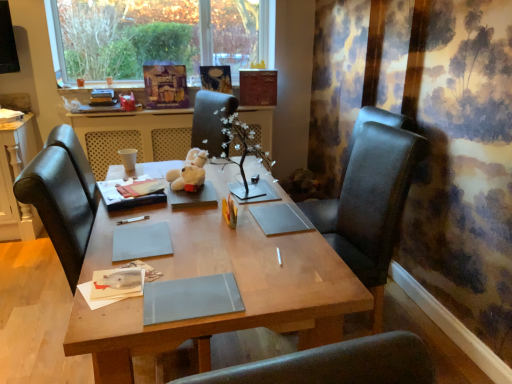
Question: From a real-world perspective, does white plush bear at center stand above black leather chair at right?

Choices:
 (A) no
 (B) yes

Answer: (B)

Question: Does white plush bear at center turn towards black leather chair at right?

Choices:
 (A) yes
 (B) no

Answer: (B)

Question: Is white plush bear at center smaller than black leather chair at right?

Choices:
 (A) yes
 (B) no

Answer: (A)

Question: From the image's perspective, is white plush bear at center on top of black leather chair at right?

Choices:
 (A) yes
 (B) no

Answer: (A)

Question: Considering the relative positions of white plush bear at center and black leather chair at right in the image provided, is white plush bear at center to the left of black leather chair at right from the viewer's perspective?

Choices:
 (A) no
 (B) yes

Answer: (B)

Question: From a real-world perspective, is white plush bear at center under black leather chair at right?

Choices:
 (A) no
 (B) yes

Answer: (A)

Question: Does wooden table at center turn towards matte gray notebook at center, placed as the first notebook when sorted from front to back?

Choices:
 (A) no
 (B) yes

Answer: (B)

Question: From the image's perspective, is wooden table at center under matte gray notebook at center, positioned as the second notebook in left-to-right order?

Choices:
 (A) yes
 (B) no

Answer: (B)

Question: Is wooden table at center in contact with matte gray notebook at center, positioned as the second notebook in left-to-right order?

Choices:
 (A) no
 (B) yes

Answer: (A)

Question: Considering the relative positions of wooden table at center and matte gray notebook at center, which is counted as the 2th notebook, starting from the top, in the image provided, is wooden table at center behind matte gray notebook at center, which is counted as the 2th notebook, starting from the top,?

Choices:
 (A) no
 (B) yes

Answer: (B)

Question: Is wooden table at center smaller than matte gray notebook at center, which is the 1th notebook in right-to-left order?

Choices:
 (A) no
 (B) yes

Answer: (A)

Question: From the image's perspective, is wooden table at center above matte gray notebook at center, placed as the first notebook when sorted from front to back?

Choices:
 (A) yes
 (B) no

Answer: (A)

Question: Is matte gray notebook at center, placed as the first notebook when sorted from front to back, positioned beyond the bounds of white plush bear at center?

Choices:
 (A) no
 (B) yes

Answer: (B)